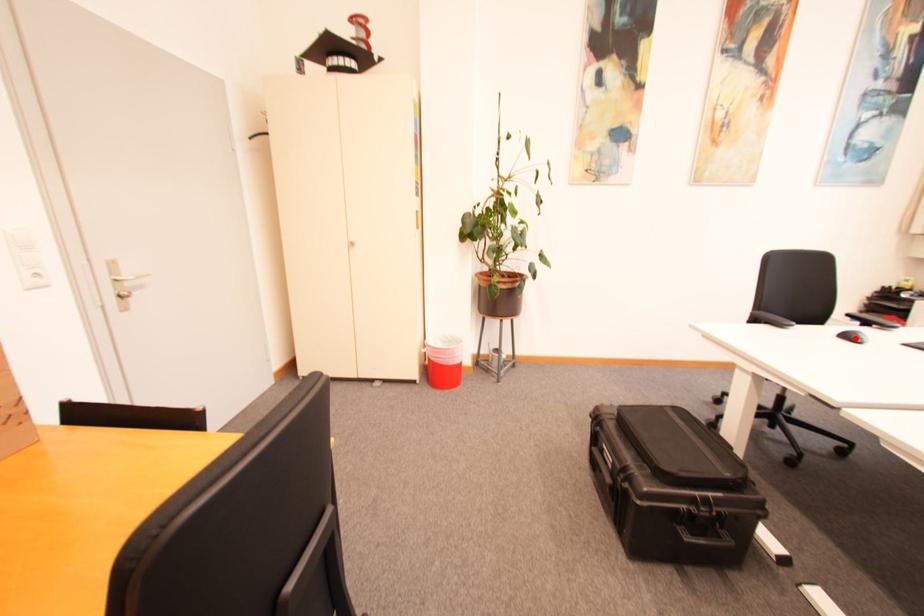
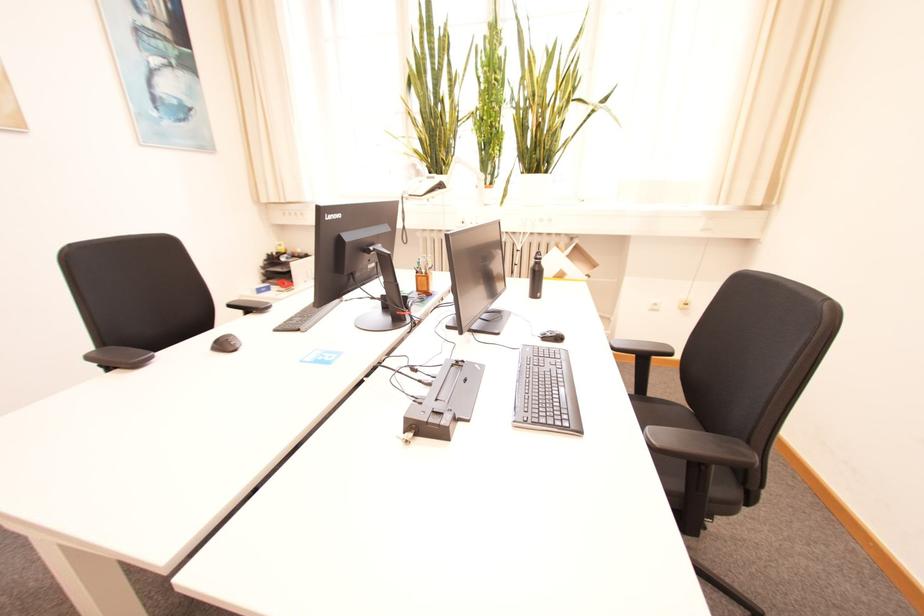
Find the pixel in the second image that matches the highlighted location in the first image.

(229, 346)